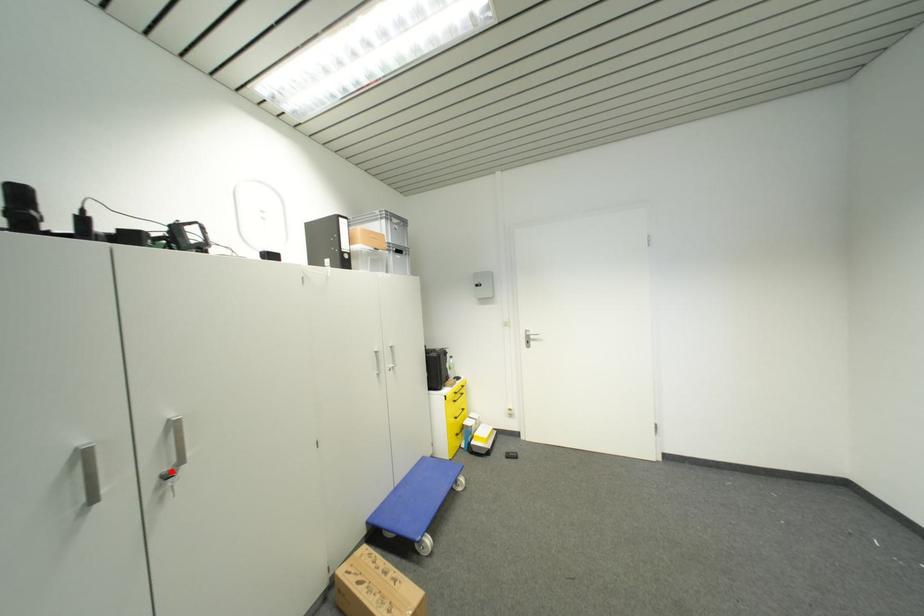
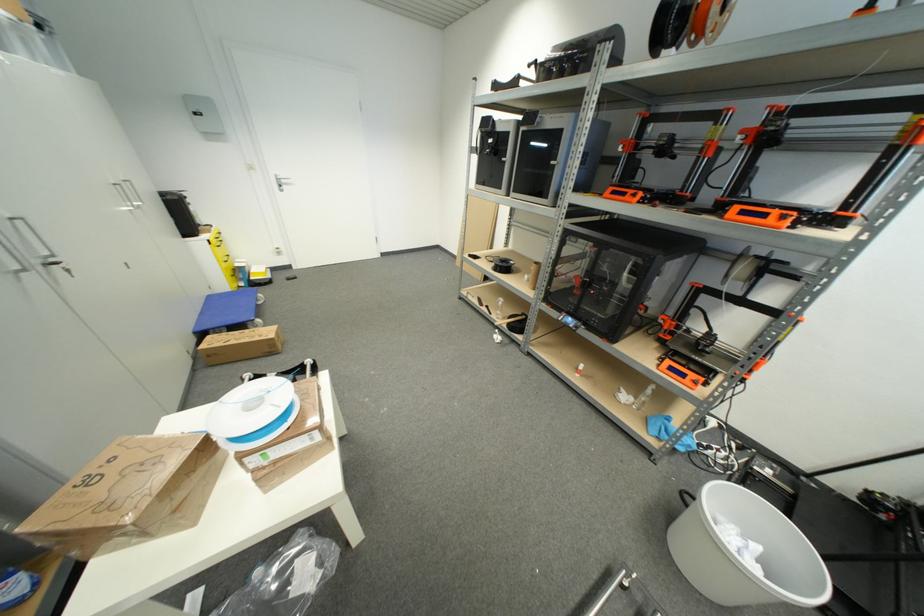
Question: I am providing you with two images of the same scene from different viewpoints. Image1 has a red point marked. In image2, the corresponding 3D location appears at what relative position? Reply with the corresponding letter.

Choices:
 (A) Closer
 (B) Farther

Answer: (B)